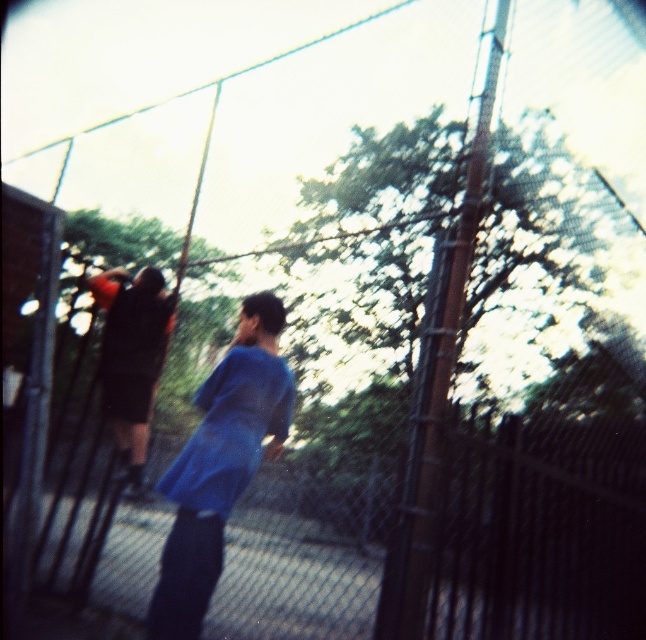
You are standing at the fence and want to greet both people wearing shirts. The blue fabric shirt at center is closer to you than the dark blue shirt at center. Which shirt should you approach first to greet them?

You should approach the blue fabric shirt at center first since it is 1.22 meters closer to you than the dark blue shirt at center.

You are standing in front of the fence and see two people behind it. The blue fabric shirt at center and the dark blue shirt at center are both visible. Which one is closer to you?

The blue fabric shirt at center is closer to the viewer than the dark blue shirt at center.